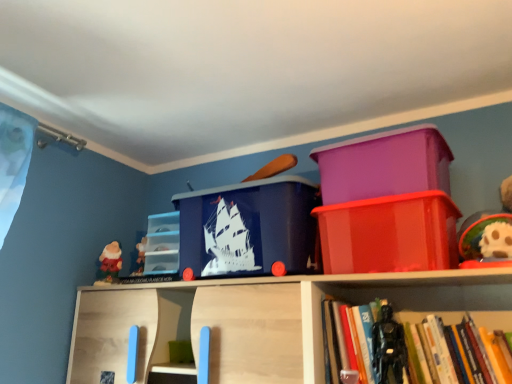
Question: Considering the positions of point (434, 332) and point (105, 271), is point (434, 332) closer or farther from the camera than point (105, 271)?

Choices:
 (A) closer
 (B) farther

Answer: (A)

Question: Considering the positions of hardcover book at lower right and red velvet santa at left, the first toy viewed from the left, in the image, is hardcover book at lower right taller or shorter than red velvet santa at left, the first toy viewed from the left,?

Choices:
 (A) tall
 (B) short

Answer: (A)

Question: Based on their relative distances, which object is nearer to the black plastic toy at center-right, the 2th toy positioned from the back?

Choices:
 (A) purple plastic container at upper right, the second storage box positioned from the right
 (B) red velvet santa at left, the 1th toy viewed from the back
 (C) transparent plastic storage box at center, which is the first storage box from left to right
 (D) glossy plastic container at upper right, which is counted as the 1th storage box, starting from the right
 (E) hardcover book at lower right

Answer: (E)

Question: Based on their relative distances, which object is nearer to the black plastic toy at center-right, the first toy positioned from the right?

Choices:
 (A) hardcover book at lower right
 (B) purple plastic container at upper right, the 3th storage box when ordered from left to right
 (C) blue plastic storage box at center, which is the third storage box from right to left
 (D) red velvet santa at left, the 1th toy viewed from the back
 (E) transparent plastic storage box at center, which ranks as the fourth storage box in right-to-left order

Answer: (A)